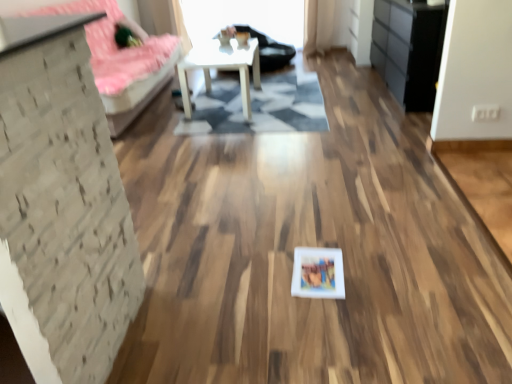
Question: Is black matte dresser at right outside matte white picture frame at center?

Choices:
 (A) no
 (B) yes

Answer: (B)

Question: Can you confirm if black matte dresser at right is smaller than matte white picture frame at center?

Choices:
 (A) yes
 (B) no

Answer: (B)

Question: From a real-world perspective, is black matte dresser at right positioned over matte white picture frame at center based on gravity?

Choices:
 (A) yes
 (B) no

Answer: (A)

Question: From a real-world perspective, is black matte dresser at right positioned under matte white picture frame at center based on gravity?

Choices:
 (A) no
 (B) yes

Answer: (A)

Question: Is black matte dresser at right closer to the viewer compared to matte white picture frame at center?

Choices:
 (A) no
 (B) yes

Answer: (A)

Question: From the image's perspective, is geometric rug at center located above or below black matte dresser at right?

Choices:
 (A) below
 (B) above

Answer: (A)

Question: Is geometric rug at center taller or shorter than black matte dresser at right?

Choices:
 (A) tall
 (B) short

Answer: (B)

Question: Considering the positions of point (285, 82) and point (400, 39), is point (285, 82) closer or farther from the camera than point (400, 39)?

Choices:
 (A) farther
 (B) closer

Answer: (A)

Question: Is geometric rug at center situated inside black matte dresser at right or outside?

Choices:
 (A) outside
 (B) inside

Answer: (A)

Question: In terms of width, does white matte table at center look wider or thinner when compared to white fabric couch at left?

Choices:
 (A) thin
 (B) wide

Answer: (A)

Question: Considering the positions of point (237, 49) and point (64, 11), is point (237, 49) closer or farther from the camera than point (64, 11)?

Choices:
 (A) farther
 (B) closer

Answer: (A)

Question: In the image, is white matte table at center positioned in front of or behind white fabric couch at left?

Choices:
 (A) behind
 (B) front

Answer: (A)

Question: From their relative heights in the image, would you say white matte table at center is taller or shorter than white fabric couch at left?

Choices:
 (A) short
 (B) tall

Answer: (A)

Question: From a real-world perspective, is white fabric couch at left positioned above or below matte white picture frame at center?

Choices:
 (A) below
 (B) above

Answer: (B)

Question: Relative to matte white picture frame at center, is white fabric couch at left in front or behind?

Choices:
 (A) front
 (B) behind

Answer: (B)